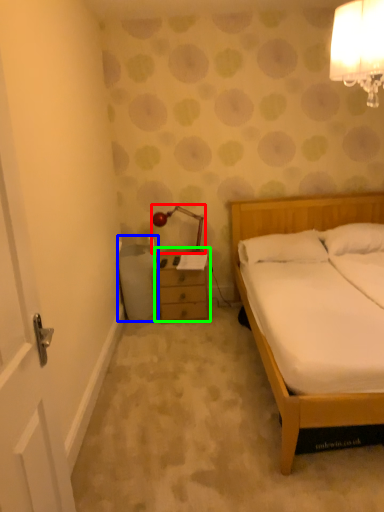
Question: Which object is the closest to the lamp (highlighted by a red box)? Choose among these: trash bin/can (highlighted by a blue box) or chest of drawers (highlighted by a green box).

Choices:
 (A) trash bin/can
 (B) chest of drawers

Answer: (B)